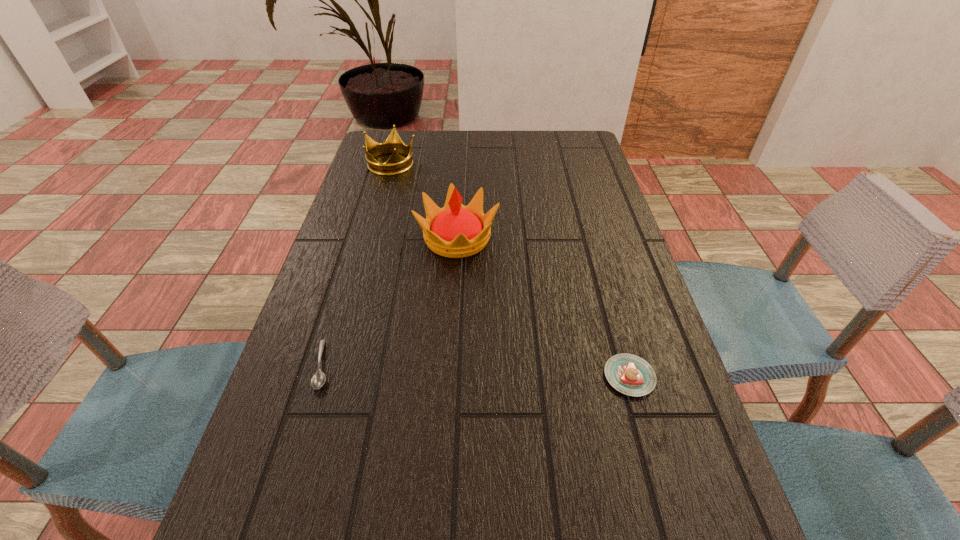
I want to click on object that ranks as the second closest to the soupspoon, so click(629, 374).

Find the location of a particular element. the second closest object relative to the nearer crown is located at coordinates (318, 379).

You are a GUI agent. You are given a task and a screenshot of the screen. Output one action in this format:
    pyautogui.click(x=<x>, y=<y>)
    Task: Click on the free space that satisfies the following two spatial constraints: 1. on the back side of the shortest object; 2. on the left side of the left crown
    The width and height of the screenshot is (960, 540).
    Given the screenshot: What is the action you would take?
    pyautogui.click(x=384, y=163)

The width and height of the screenshot is (960, 540). What are the coordinates of `blank space that satisfies the following two spatial constraints: 1. on the back side of the taller crown; 2. on the right side of the soupspoon` in the screenshot? It's located at (361, 238).

Find the location of `free space that satisfies the following two spatial constraints: 1. on the front side of the second shortest object; 2. on the left side of the left crown`. free space that satisfies the following two spatial constraints: 1. on the front side of the second shortest object; 2. on the left side of the left crown is located at coordinates (331, 376).